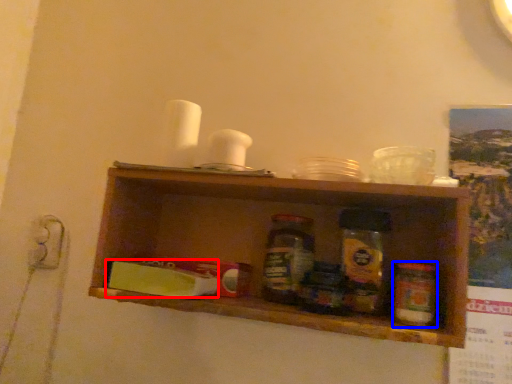
Question: Which of the following is the closest to the observer, food (highlighted by a red box) or bottle (highlighted by a blue box)?

Choices:
 (A) food
 (B) bottle

Answer: (B)